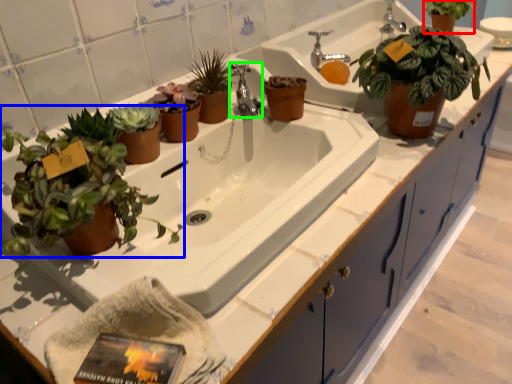
Question: Which object is the farthest from houseplant (highlighted by a red box)? Choose among these: houseplant (highlighted by a blue box) or tap (highlighted by a green box).

Choices:
 (A) houseplant
 (B) tap

Answer: (A)